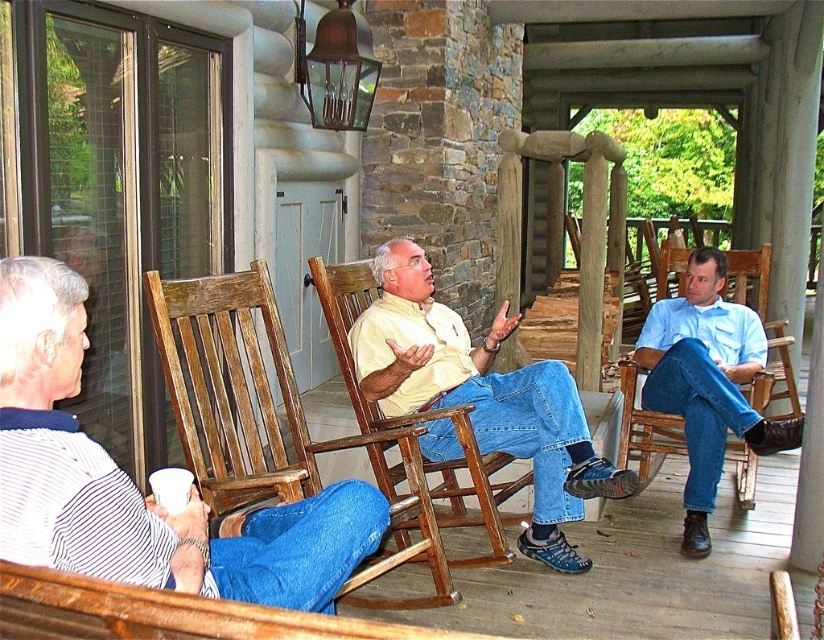
You are standing on the porch of the rustic log cabin and notice two points marked in the scene. The first point is at coordinates point (49, 492) and the second is at point (696, 490). Which of these two points is nearer to you?

Point (49, 492) is closer to the viewer than point (696, 490), so the first point is nearer to you.

You are standing on the porch of the rustic log cabin and notice two people in the scene. One is wearing a matte yellow shirt at center and the other a light blue shirt at right. If you want to join the conversation, which direction should you move to face both individuals comfortably?

Since the matte yellow shirt at center is to the left of the light blue shirt at right, you should move to the center of the porch so that both individuals are visible to you. Facing towards the center area between them would allow you to see both the matte yellow shirt at center and the light blue shirt at right comfortably.

You are standing on the porch and want to place a small potted plant between the two points marked as point (150, 545) and point (417, 394). Which point should the plant be closer to in order to be nearer to the viewer?

The plant should be placed closer to point (150, 545) because it is nearer to the viewer compared to point (417, 394).